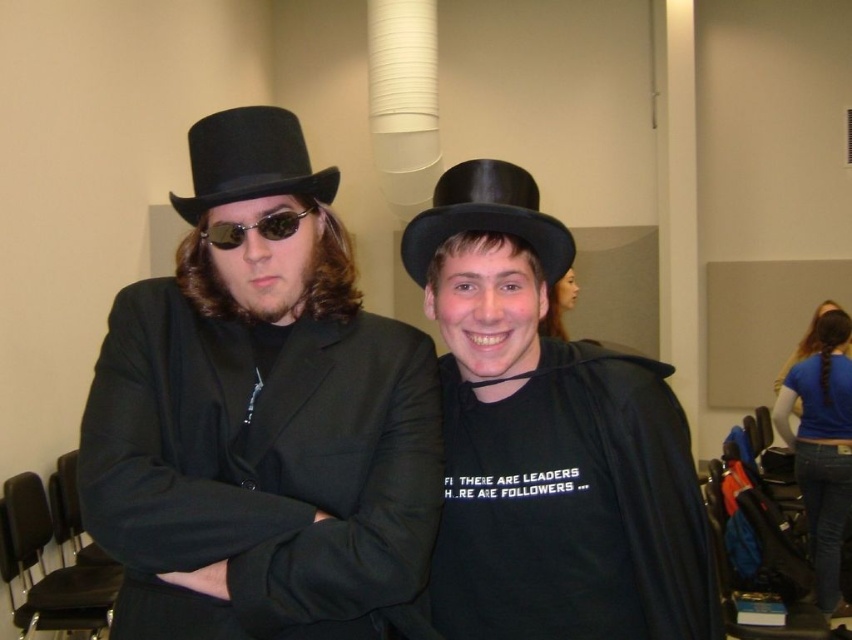
Question: Which of the following is the farthest from the observer?

Choices:
 (A) (231, 227)
 (B) (263, 124)

Answer: (B)

Question: Does matte black top hat at center come behind matte black sunglasses at center?

Choices:
 (A) yes
 (B) no

Answer: (B)

Question: Where is black felt fedora at left located in relation to matte black sunglasses at center in the image?

Choices:
 (A) below
 (B) above

Answer: (B)

Question: Can you confirm if matte black top hat at center is wider than black felt fedora at center?

Choices:
 (A) yes
 (B) no

Answer: (A)

Question: Which object is positioned farthest from the black felt fedora at center?

Choices:
 (A) matte black hat at center
 (B) black felt fedora at left
 (C) matte black sunglasses at center
 (D) matte black top hat at center

Answer: (D)

Question: Which of the following is the farthest from the observer?

Choices:
 (A) black felt fedora at center
 (B) black felt fedora at left
 (C) matte black hat at center
 (D) matte black sunglasses at center

Answer: (A)